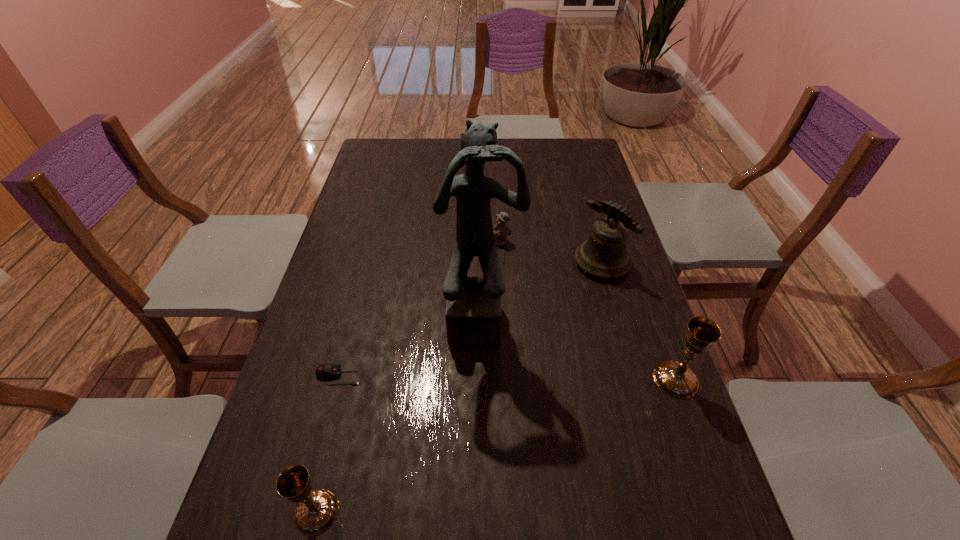
Locate an element on the screen. The image size is (960, 540). free space that satisfies the following two spatial constraints: 1. on the front-facing side of the second shortest object; 2. on the left side of the right chalice is located at coordinates (509, 380).

Where is `free location that satisfies the following two spatial constraints: 1. on the front-facing side of the second shortest object; 2. on the right side of the farther chalice`? The image size is (960, 540). free location that satisfies the following two spatial constraints: 1. on the front-facing side of the second shortest object; 2. on the right side of the farther chalice is located at coordinates (509, 380).